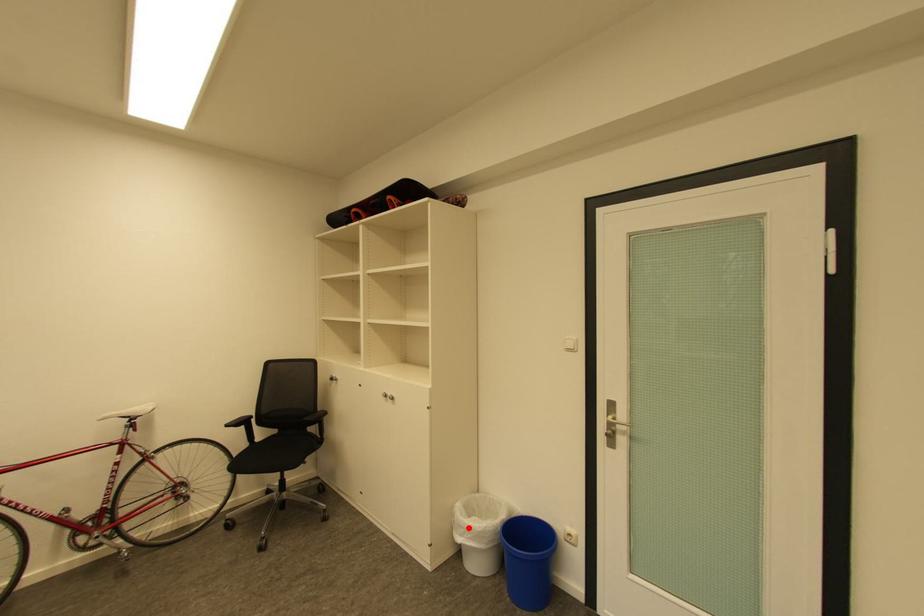
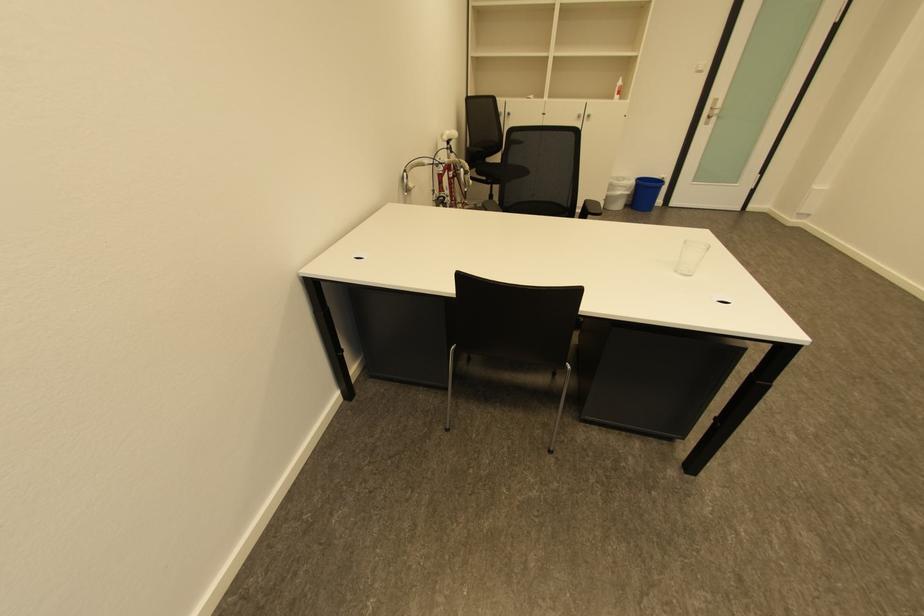
Find the pixel in the second image that matches the highlighted location in the first image.

(626, 188)